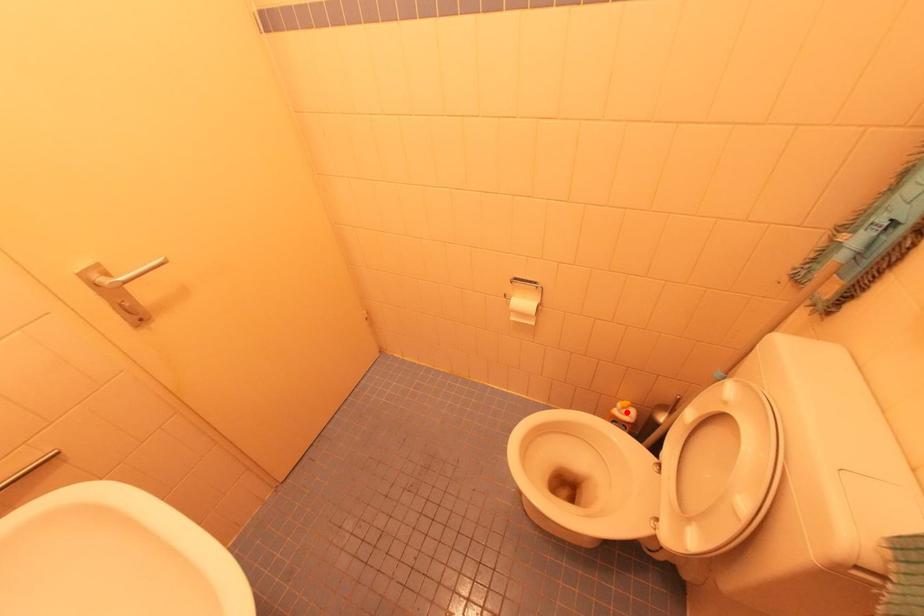
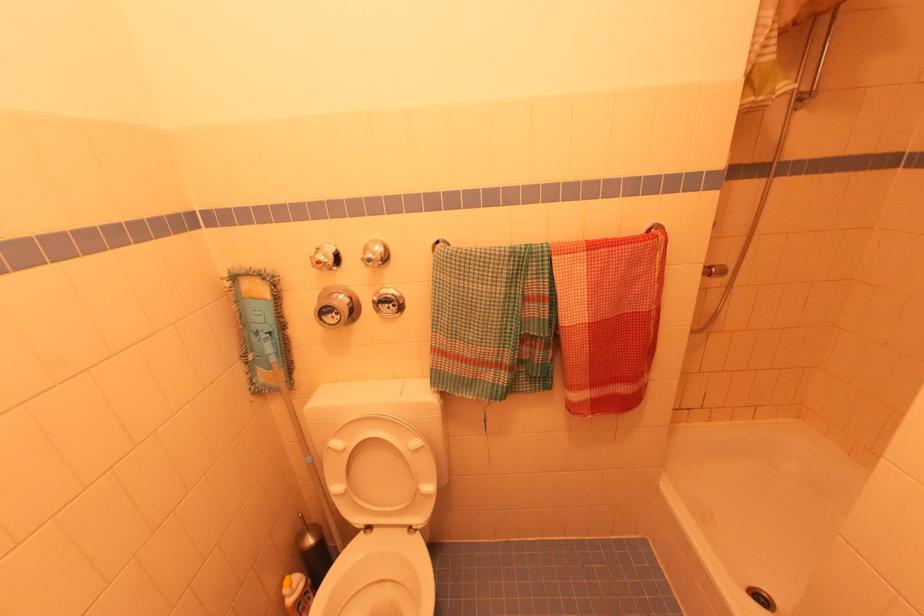
Question: I am providing you with two images of the same scene from different viewpoints. In image1, a red point is highlighted. Considering the same 3D point in image2, which of the following is correct?

Choices:
 (A) It is closer
 (B) It is farther

Answer: (B)